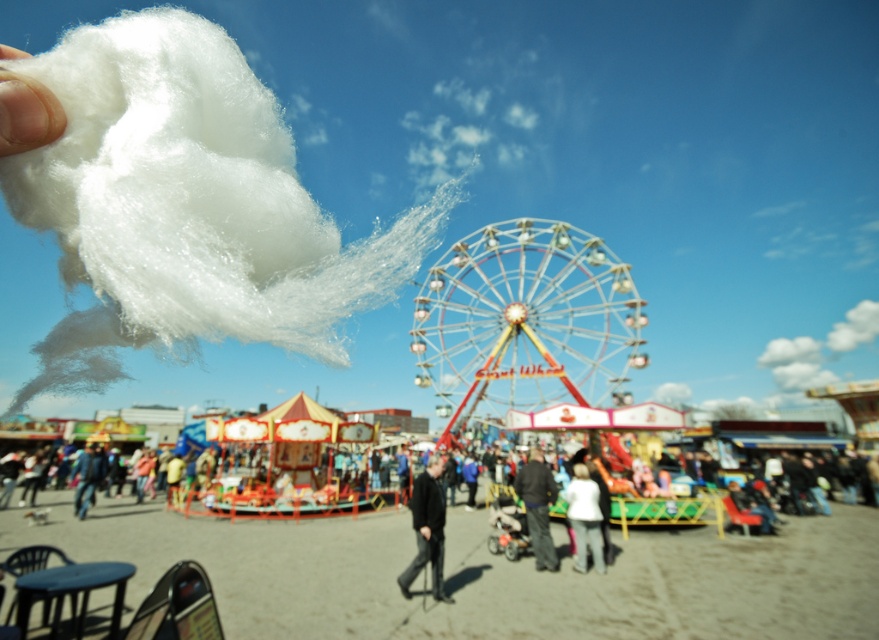
You are a maintenance worker needing to inspect the metallic shiny ferris wheel at center and the dark gray fabric at center. Given that your inspection equipment has a maximum range of 40 meters, can you inspect both objects without moving closer?

The distance between the metallic shiny ferris wheel at center and the dark gray fabric at center is 41.00 meters, which exceeds the equipment range of 40 meters. Therefore, you cannot inspect both objects without moving closer.

You are standing at the center of the fairground and want to locate the metallic shiny ferris wheel at center. According to the coordinates provided, where exactly is the ferris wheel positioned?

The metallic shiny ferris wheel at center is located at point [527,321].

You are at the fairground and want to take a photo of both the metallic shiny ferris wheel at center and the white fluffy cotton at upper left. Which object should you position to your left to include both in the frame?

To include both the metallic shiny ferris wheel at center and the white fluffy cotton at upper left in the frame, position the white fluffy cotton at upper left to your left since it is located to the left of the metallic shiny ferris wheel at center.